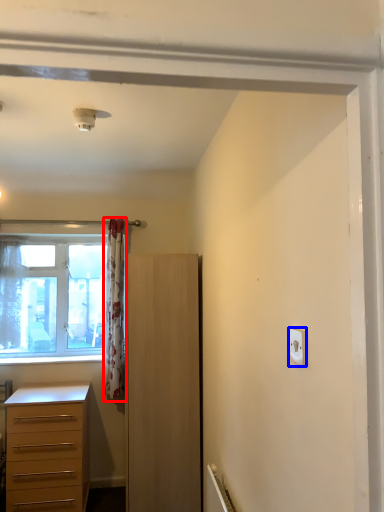
Question: Among these objects, which one is farthest to the camera, curtain (highlighted by a red box) or light switch (highlighted by a blue box)?

Choices:
 (A) curtain
 (B) light switch

Answer: (A)